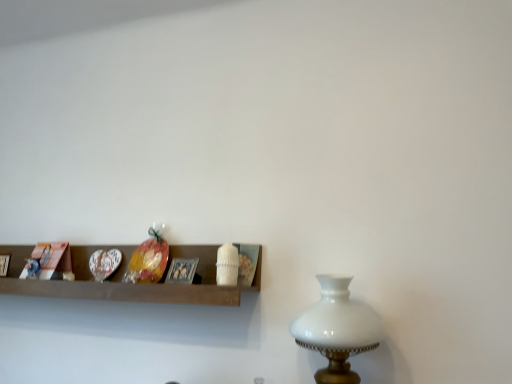
Question: Based on their sizes in the image, would you say metallic silver picture frame at center is bigger or smaller than white glass table lamp at right?

Choices:
 (A) small
 (B) big

Answer: (A)

Question: Relative to white glass table lamp at right, is metallic silver picture frame at center in front or behind?

Choices:
 (A) front
 (B) behind

Answer: (B)

Question: Which object is the farthest from the wooden shelf at center?

Choices:
 (A) white glass table lamp at right
 (B) metallic silver picture frame at center

Answer: (A)

Question: Considering the real-world distances, which object is farthest from the metallic silver picture frame at center?

Choices:
 (A) wooden shelf at center
 (B) white glass table lamp at right

Answer: (B)